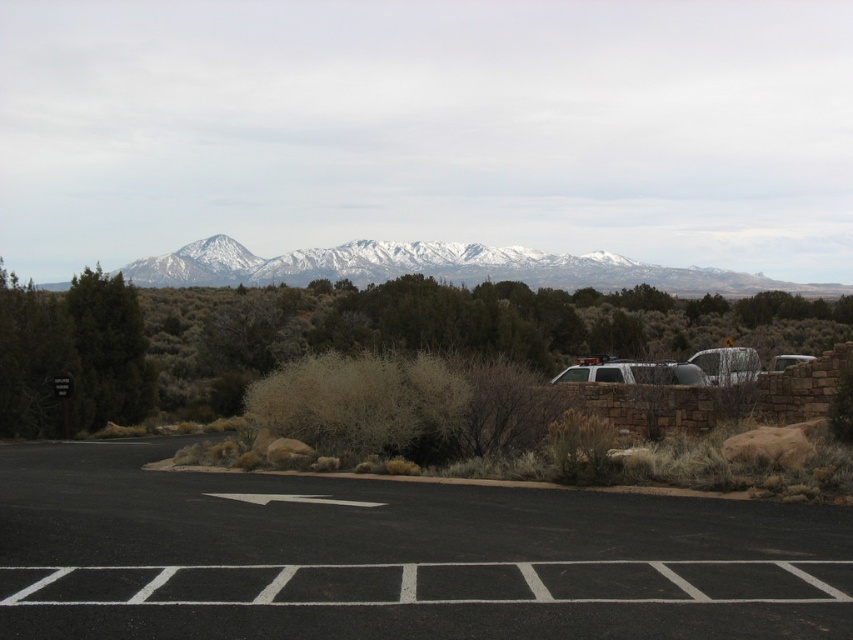
What do you see at coordinates (395, 557) in the screenshot? The width and height of the screenshot is (853, 640). I see `black asphalt parking lot at lower center` at bounding box center [395, 557].

Is black asphalt parking lot at lower center taller than white matte car at right?

Incorrect, black asphalt parking lot at lower center's height is not larger of white matte car at right's.

Identify the location of black asphalt parking lot at lower center. This screenshot has width=853, height=640. (395, 557).

Locate an element on the screen. The height and width of the screenshot is (640, 853). black asphalt parking lot at lower center is located at coordinates (395, 557).

Does snow-covered mountains at upper center appear over green matte tree at left?

Indeed, snow-covered mountains at upper center is positioned over green matte tree at left.

Between snow-covered mountains at upper center and green matte tree at left, which one appears on the right side from the viewer's perspective?

snow-covered mountains at upper center is more to the right.

Between point (167, 259) and point (91, 342), which one is positioned behind?

The point (167, 259) is more distant.

The width and height of the screenshot is (853, 640). Identify the location of snow-covered mountains at upper center. (444, 268).

Between point (769, 573) and point (703, 353), which one is positioned in front?

Point (769, 573)

Can you confirm if black asphalt parking lot at lower center is smaller than silver metallic suv at center-right?

No.

Between point (476, 584) and point (695, 362), which one is positioned behind?

Point (695, 362)

Find the location of a particular element. black asphalt parking lot at lower center is located at coordinates (395, 557).